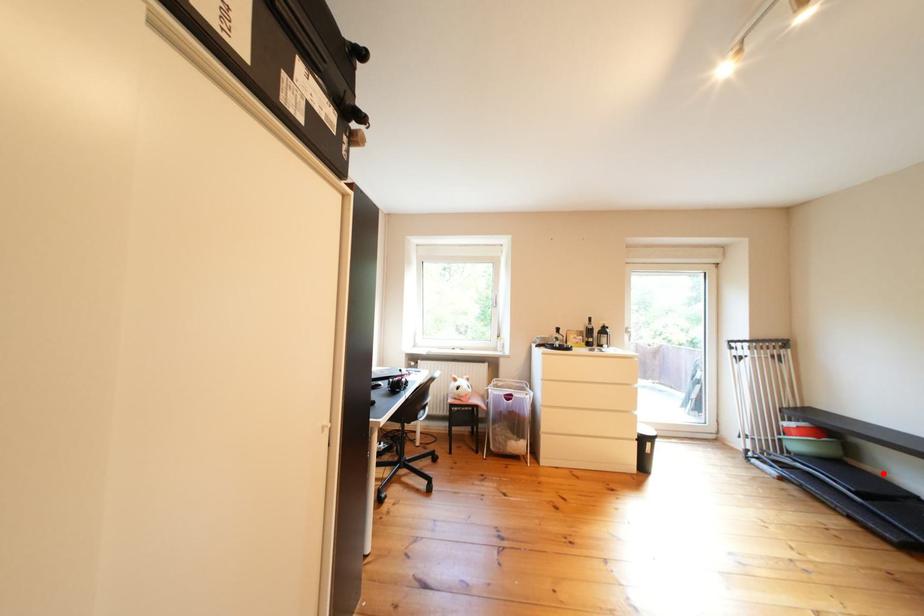
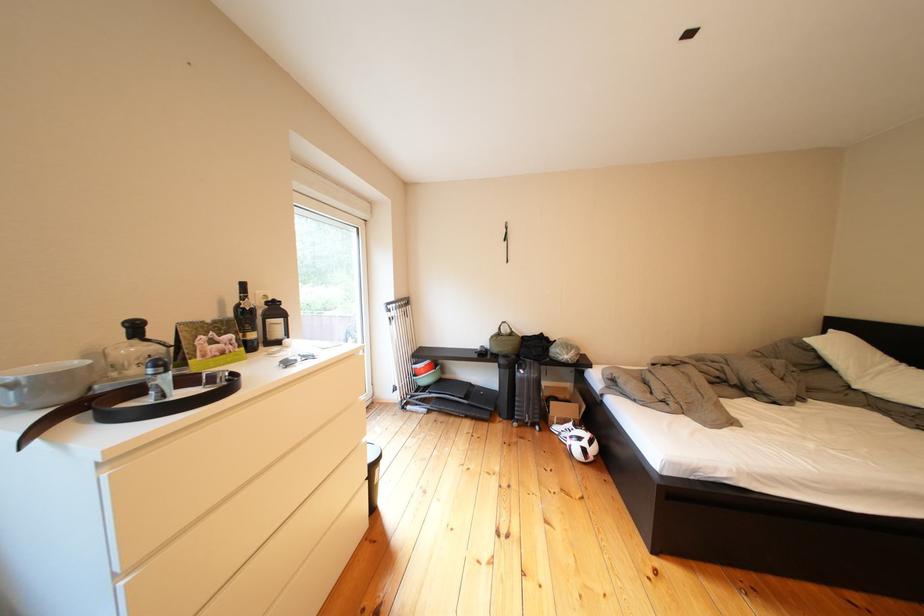
Question: I am providing you with two images of the same scene from different viewpoints. Image1 has a red point marked. In image2, the corresponding 3D location appears at what relative position? Reply with the corresponding letter.

Choices:
 (A) Closer
 (B) Farther

Answer: (B)